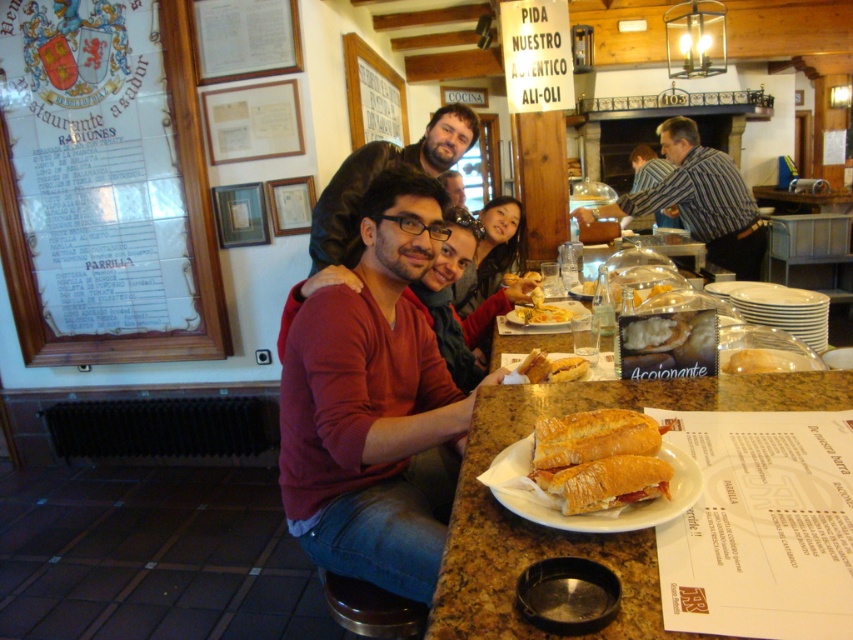
Does point (409, 246) come in front of point (541, 323)?

Yes, point (409, 246) is in front of point (541, 323).

Consider the image. Does matte red sweater at center appear on the left side of golden brown bread at center?

Correct, you'll find matte red sweater at center to the left of golden brown bread at center.

Between point (397, 390) and point (521, 317), which one is positioned behind?

The point (521, 317) is more distant.

The height and width of the screenshot is (640, 853). What are the coordinates of `matte red sweater at center` in the screenshot? It's located at (373, 404).

Does matte white plate at center have a larger size compared to brown bread at center?

Indeed, matte white plate at center has a larger size compared to brown bread at center.

Consider the image. Is the position of matte white plate at center less distant than that of brown bread at center?

No, it is behind brown bread at center.

Does point (527, 324) come behind point (786, 369)?

Yes, point (527, 324) is behind point (786, 369).

At what (x,y) coordinates should I click in order to perform the action: click on matte white plate at center. Please return your answer as a coordinate pair (x, y). Looking at the image, I should click on (544, 314).

Who is more distant from viewer, (601,513) or (550,362)?

Point (550,362)

Is white paper plate at center thinner than slightly toasted bread at center?

No.

Where is `white paper plate at center`? white paper plate at center is located at coordinates (596, 512).

Identify the location of white paper plate at center. (596, 512).